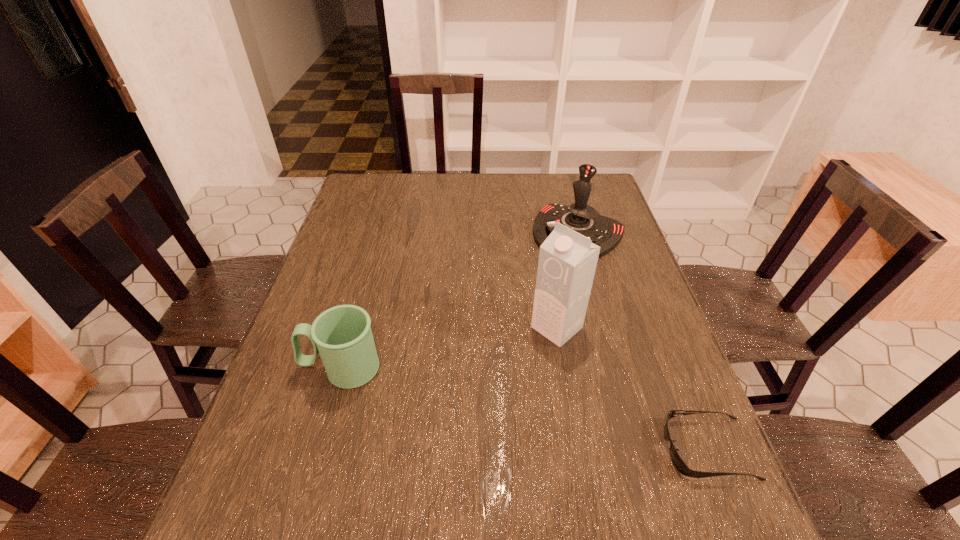
In order to click on vacant space at the near right corner of the desktop in this screenshot , I will do `click(639, 472)`.

The width and height of the screenshot is (960, 540). I want to click on free space between the shortest object and the tallest object, so click(633, 388).

Find the location of `vacant space that's between the third tallest object and the shortest object`. vacant space that's between the third tallest object and the shortest object is located at coordinates (525, 409).

Locate an element on the screen. unoccupied position between the mug and the second tallest object is located at coordinates (460, 301).

Locate an element on the screen. This screenshot has height=540, width=960. vacant area that lies between the third nearest object and the third tallest object is located at coordinates (449, 348).

Locate an element on the screen. unoccupied position between the third farthest object and the third nearest object is located at coordinates (449, 348).

Where is `free space between the mug and the carton`? This screenshot has height=540, width=960. free space between the mug and the carton is located at coordinates (449, 348).

Image resolution: width=960 pixels, height=540 pixels. What are the coordinates of `free space between the sunglasses and the second farthest object` in the screenshot? It's located at (633, 388).

Identify the location of free space between the mug and the third shortest object. The height and width of the screenshot is (540, 960). (460, 301).

I want to click on unoccupied area between the shortest object and the carton, so coord(633,388).